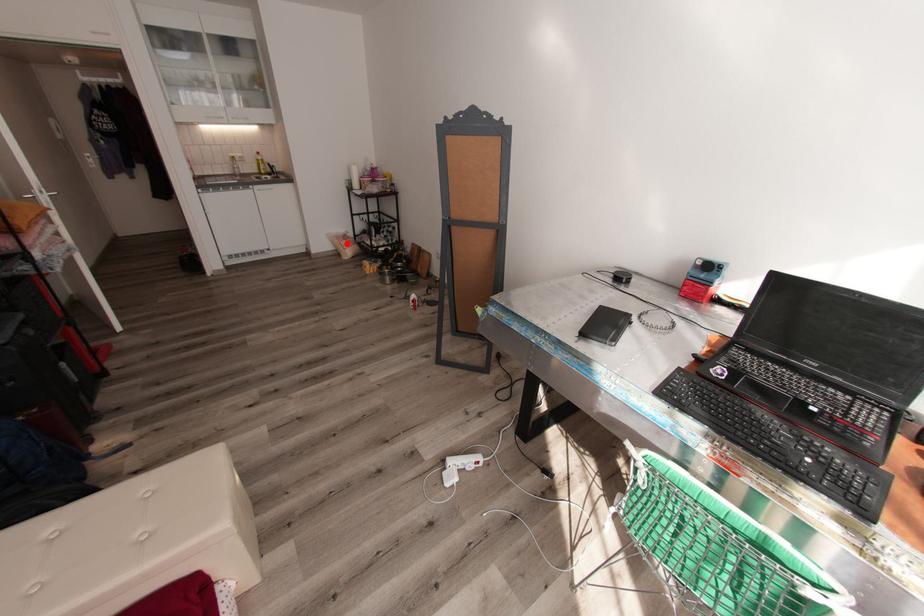
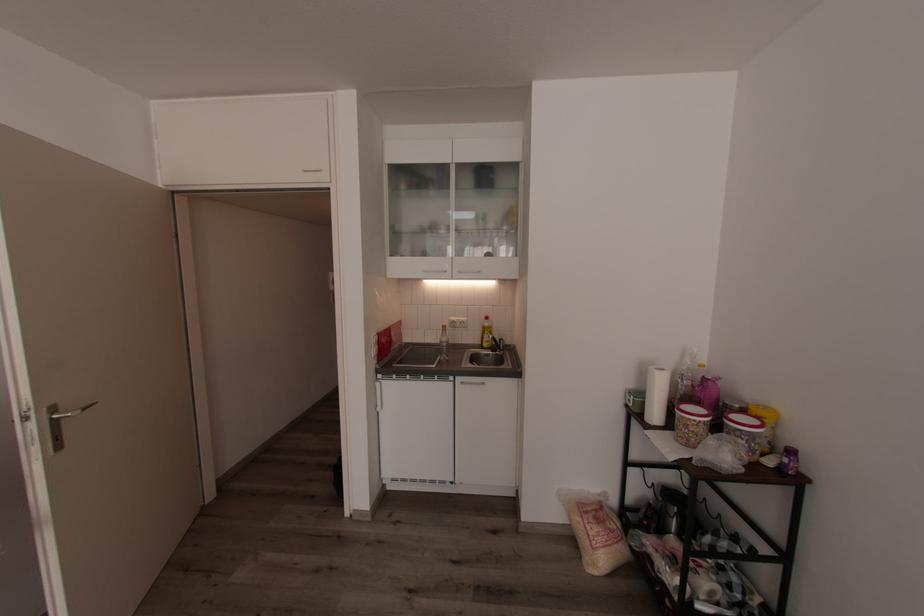
Question: I am providing you with two images of the same scene from different viewpoints. Given a red point in image1, look at the same physical point in image2. Is it:

Choices:
 (A) Closer to the viewpoint
 (B) Farther from the viewpoint

Answer: (B)